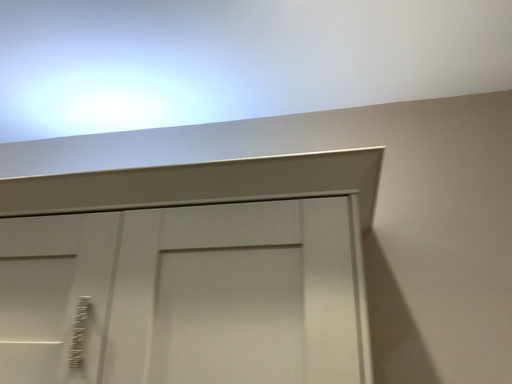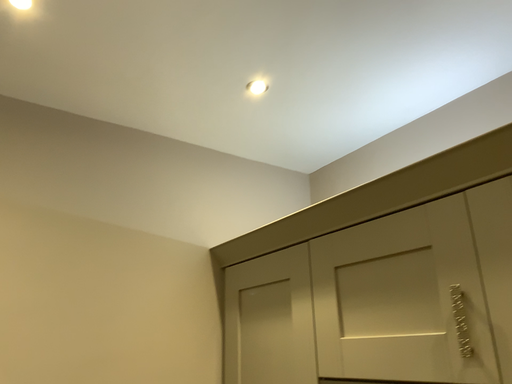
Question: Which way did the camera rotate in the video?

Choices:
 (A) rotated right
 (B) rotated left

Answer: (B)